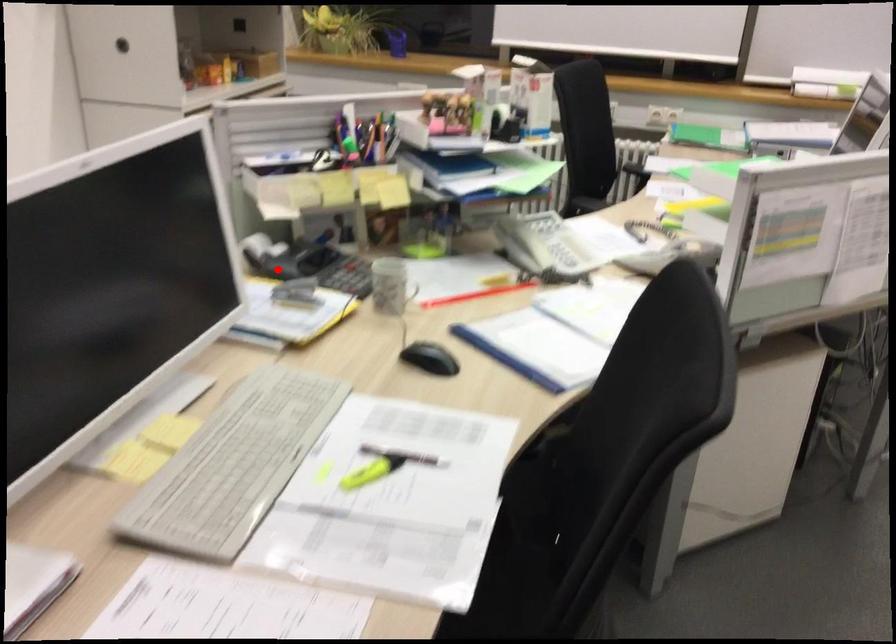
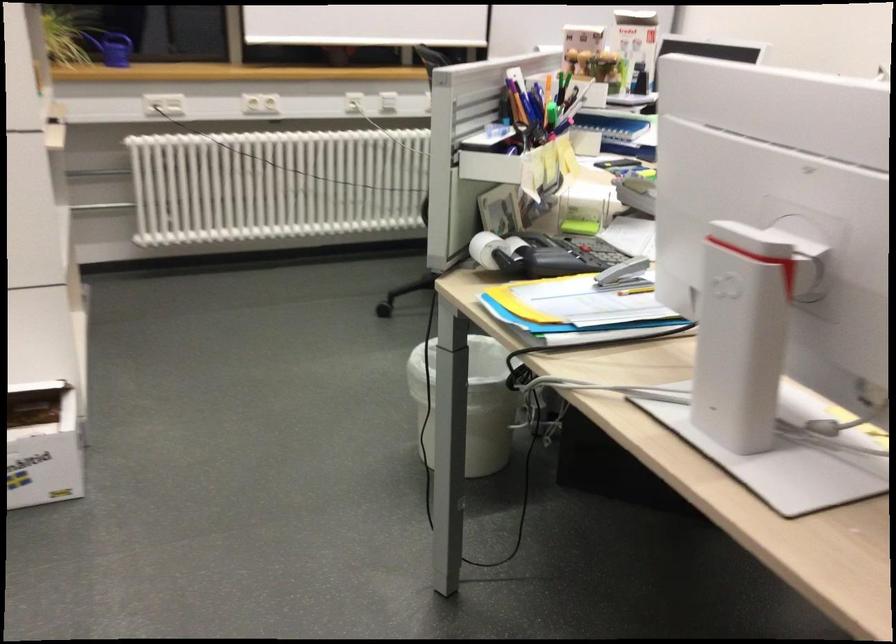
Question: A red point is marked in image1. In image2, is the corresponding 3D point closer to the camera or farther? Reply with the corresponding letter.

Choices:
 (A) The corresponding 3D point is closer.
 (B) The corresponding 3D point is farther.

Answer: (A)